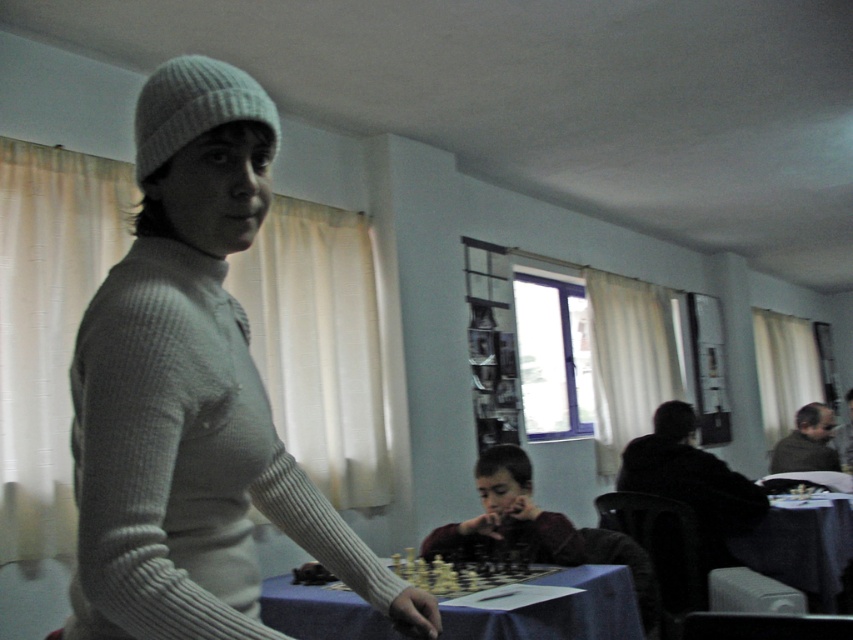
Question: Considering the real-world distances, which object is closest to the white ribbed sweater at center?

Choices:
 (A) dark blue fabric table at lower right
 (B) blue fabric table at center
 (C) dark red sweater at center

Answer: (B)

Question: In this image, where is blue fabric table at center located relative to dark red sweater at center?

Choices:
 (A) left
 (B) right

Answer: (A)

Question: Which point is farther to the camera?

Choices:
 (A) (773, 502)
 (B) (602, 598)
 (C) (457, 556)

Answer: (A)

Question: Is white ribbed sweater at center to the left of dark red sweater at center from the viewer's perspective?

Choices:
 (A) yes
 (B) no

Answer: (A)

Question: In this image, where is blue fabric table at center located relative to dark red sweater at center?

Choices:
 (A) left
 (B) right

Answer: (A)

Question: Estimate the real-world distances between objects in this image. Which object is farther from the dark blue fabric table at lower right?

Choices:
 (A) white ribbed sweater at center
 (B) dark red sweater at center

Answer: (A)